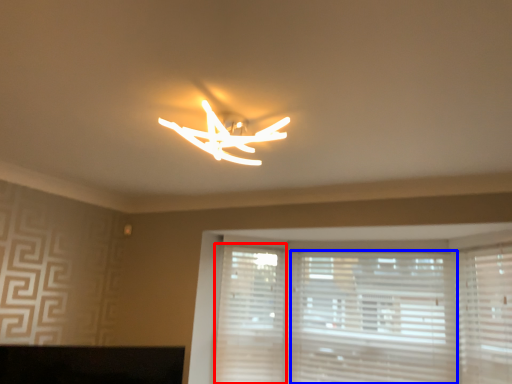
Question: Which object appears closest to the camera in this image, shutter (highlighted by a red box) or blind (highlighted by a blue box)?

Choices:
 (A) shutter
 (B) blind

Answer: (B)